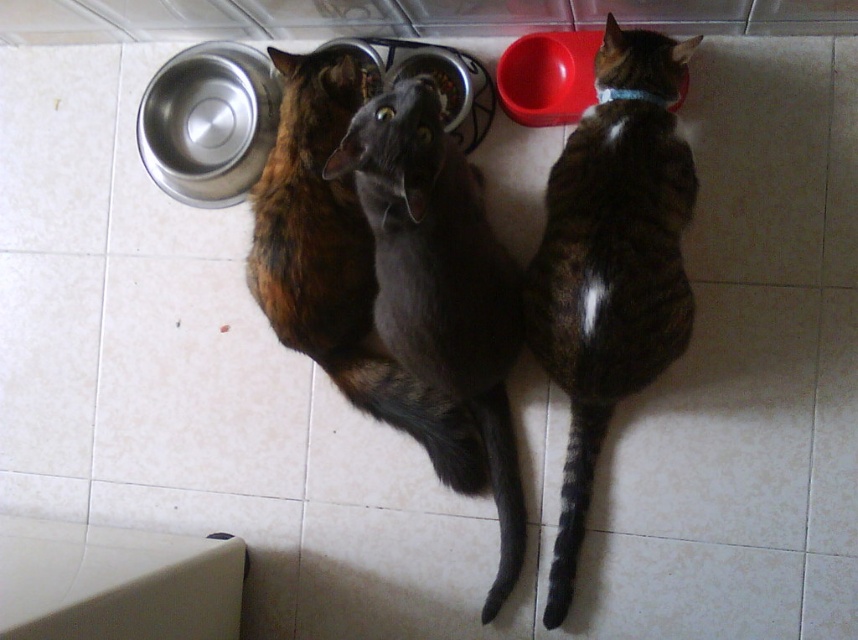
You are a photographer taking a picture of the shiny gray cat at center. The camera is positioned directly above the cat. What are the coordinates of the cat in the image?

The coordinates of the shiny gray cat at center are at point (x=440, y=284).

You are looking down at the tiled floor where the cats are. Which object is higher up between the tabby fur cat at right and the metallic silver bowl at center?

The metallic silver bowl at center is higher up than the tabby fur cat at right because the cat is below the bowl.

You are a cat owner who wants to place a new feeding bowl between the tabby fur cat at right and the calico fur cat at center. Based on their sizes, which cat will have more space between them and the bowl?

The tabby fur cat at right has a smaller width than the calico fur cat at center, so placing the bowl between them would leave more space between the tabby fur cat at right and the bowl compared to the calico fur cat at center.